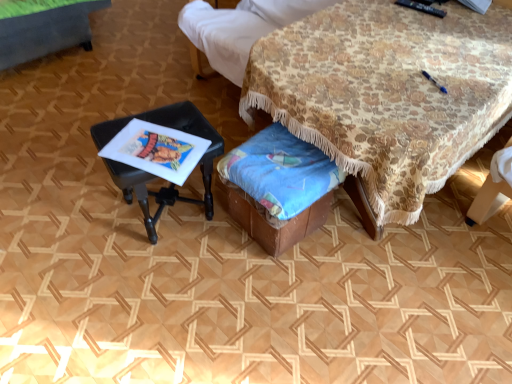
You are a GUI agent. You are given a task and a screenshot of the screen. Output one action in this format:
    pyautogui.click(x=<x>, y=<y>)
    Task: Click on the vacant space to the left of black plastic stool at left, arranged as the 1th table when viewed from the left
    
    Given the screenshot: What is the action you would take?
    pyautogui.click(x=81, y=215)